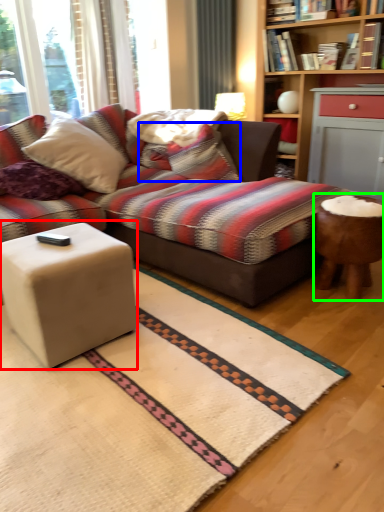
Question: Which object is the farthest from coffee table (highlighted by a red box)? Choose among these: pillow (highlighted by a blue box) or table (highlighted by a green box).

Choices:
 (A) pillow
 (B) table

Answer: (A)